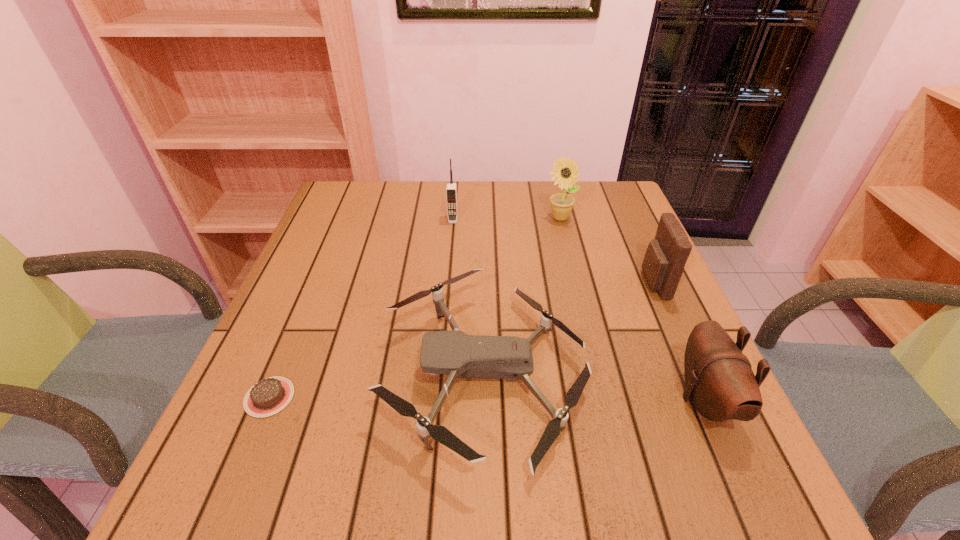
The image size is (960, 540). Find the location of `cellular telephone situated at the far edge`. cellular telephone situated at the far edge is located at coordinates (451, 190).

Where is `object that is at the near edge`? The width and height of the screenshot is (960, 540). object that is at the near edge is located at coordinates (453, 352).

Identify the location of object that is at the left edge. (269, 396).

Find the location of a particular element. blank space at the far edge of the desktop is located at coordinates (405, 195).

At what (x,y) coordinates should I click in order to perform the action: click on vacant space at the near edge of the desktop. Please return your answer as a coordinate pair (x, y). Looking at the image, I should click on (574, 461).

In the image, there is a desktop. Find the location of `vacant space at the left edge`. vacant space at the left edge is located at coordinates (225, 413).

Where is `vacant space at the near left corner of the desktop`? vacant space at the near left corner of the desktop is located at coordinates (283, 500).

You are a GUI agent. You are given a task and a screenshot of the screen. Output one action in this format:
    pyautogui.click(x=<x>, y=<y>)
    Task: Click on the free space at the near right corner of the desktop
    This screenshot has width=960, height=540.
    Given the screenshot: What is the action you would take?
    pyautogui.click(x=704, y=512)

The image size is (960, 540). I want to click on vacant area between the sunflower and the farther pouch, so click(607, 251).

Where is `blank region between the cellular telephone and the nearer pouch`? The height and width of the screenshot is (540, 960). blank region between the cellular telephone and the nearer pouch is located at coordinates (579, 309).